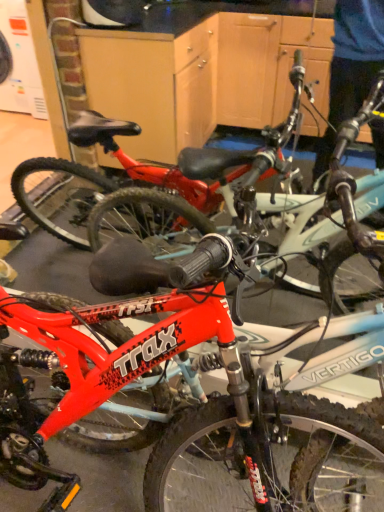
Question: Which direction should I rotate to look at shiny red bicycle at center, the 2th bicycle in the bottom-to-top sequence?

Choices:
 (A) right
 (B) left

Answer: (B)

Question: Is shiny red bicycle at center, positioned as the 1th bicycle in bottom-to-top order, oriented away from shiny red bicycle at center, the 2th bicycle in the bottom-to-top sequence?

Choices:
 (A) no
 (B) yes

Answer: (B)

Question: Considering the relative sizes of shiny red bicycle at center, marked as the 2th bicycle in a top-to-bottom arrangement, and shiny red bicycle at center, the first bicycle viewed from the top, in the image provided, is shiny red bicycle at center, marked as the 2th bicycle in a top-to-bottom arrangement, wider than shiny red bicycle at center, the first bicycle viewed from the top,?

Choices:
 (A) no
 (B) yes

Answer: (B)

Question: Can you confirm if shiny red bicycle at center, marked as the 2th bicycle in a top-to-bottom arrangement, is shorter than shiny red bicycle at center, the 2th bicycle in the bottom-to-top sequence?

Choices:
 (A) no
 (B) yes

Answer: (A)

Question: Is shiny red bicycle at center, positioned as the 1th bicycle in bottom-to-top order, at the left side of shiny red bicycle at center, the first bicycle viewed from the top?

Choices:
 (A) no
 (B) yes

Answer: (A)

Question: Considering the relative sizes of shiny red bicycle at center, marked as the 2th bicycle in a top-to-bottom arrangement, and shiny red bicycle at center, the first bicycle viewed from the top, in the image provided, is shiny red bicycle at center, marked as the 2th bicycle in a top-to-bottom arrangement, bigger than shiny red bicycle at center, the first bicycle viewed from the top,?

Choices:
 (A) no
 (B) yes

Answer: (B)

Question: From the image's perspective, does shiny red bicycle at center, marked as the 2th bicycle in a top-to-bottom arrangement, appear lower than shiny red bicycle at center, the 2th bicycle in the bottom-to-top sequence?

Choices:
 (A) no
 (B) yes

Answer: (B)

Question: Could you tell me if shiny red bicycle at center, the first bicycle viewed from the top, is facing shiny red bicycle at center, positioned as the 1th bicycle in bottom-to-top order?

Choices:
 (A) yes
 (B) no

Answer: (A)

Question: From the image's perspective, is shiny red bicycle at center, the first bicycle viewed from the top, beneath shiny red bicycle at center, marked as the 2th bicycle in a top-to-bottom arrangement?

Choices:
 (A) yes
 (B) no

Answer: (B)

Question: Is shiny red bicycle at center, the first bicycle viewed from the top, touching shiny red bicycle at center, positioned as the 1th bicycle in bottom-to-top order?

Choices:
 (A) yes
 (B) no

Answer: (B)

Question: Is shiny red bicycle at center, the first bicycle viewed from the top, wider than shiny red bicycle at center, positioned as the 1th bicycle in bottom-to-top order?

Choices:
 (A) yes
 (B) no

Answer: (B)

Question: Can you confirm if shiny red bicycle at center, the 2th bicycle in the bottom-to-top sequence, is positioned to the left of shiny red bicycle at center, marked as the 2th bicycle in a top-to-bottom arrangement?

Choices:
 (A) yes
 (B) no

Answer: (A)

Question: From the image's perspective, does shiny red bicycle at center, the first bicycle viewed from the top, appear higher than shiny red bicycle at center, marked as the 2th bicycle in a top-to-bottom arrangement?

Choices:
 (A) no
 (B) yes

Answer: (B)

Question: Looking at their shapes, would you say shiny red bicycle at center, marked as the 2th bicycle in a top-to-bottom arrangement, is wider or thinner than shiny red bicycle at center, the 2th bicycle in the bottom-to-top sequence?

Choices:
 (A) thin
 (B) wide

Answer: (B)